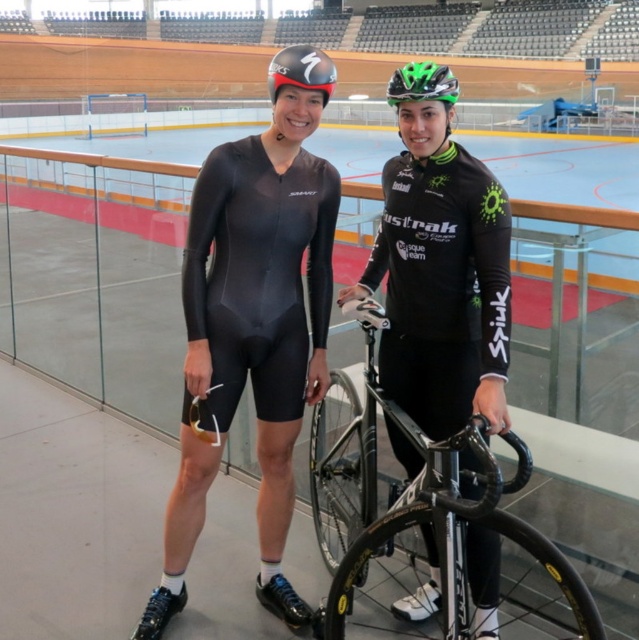
Question: Is shiny black frame at center to the left of matte black helmet at upper center from the viewer's perspective?

Choices:
 (A) yes
 (B) no

Answer: (B)

Question: Does black matte suit at center appear over black matte cycling suit at center?

Choices:
 (A) yes
 (B) no

Answer: (A)

Question: Considering the relative positions of black matte suit at center and shiny black frame at center in the image provided, where is black matte suit at center located with respect to shiny black frame at center?

Choices:
 (A) above
 (B) below

Answer: (A)

Question: Which object appears farthest from the camera in this image?

Choices:
 (A) green matte helmet at center
 (B) black matte cycling suit at center
 (C) matte black helmet at upper center
 (D) black matte suit at center

Answer: (C)

Question: Which point is closer to the camera?

Choices:
 (A) green matte helmet at upper center
 (B) black matte suit at center
 (C) shiny black frame at center

Answer: (C)

Question: Among these points, which one is nearest to the camera?

Choices:
 (A) (473, 401)
 (B) (304, 54)
 (C) (397, 72)
 (D) (265, 513)

Answer: (A)